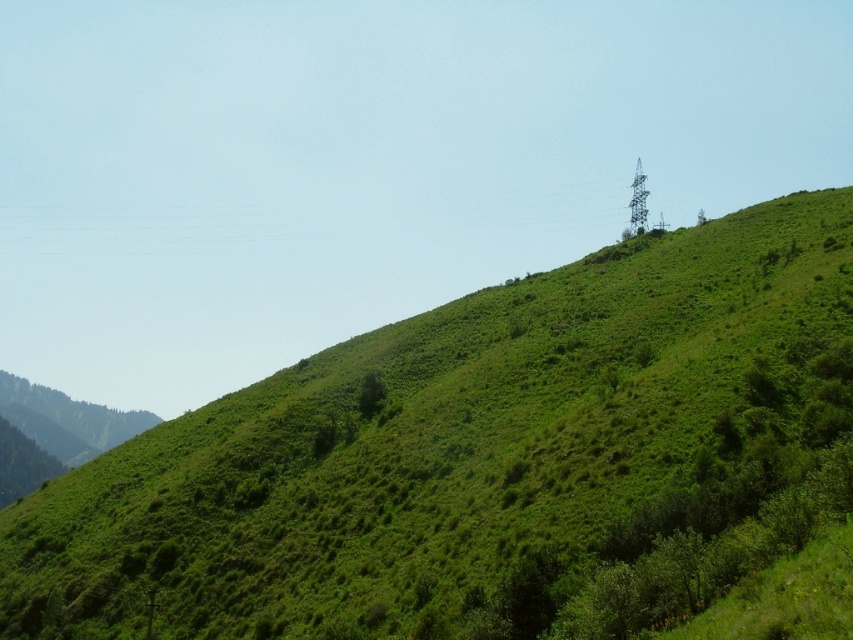
Question: Does green leafy tree at lower left have a greater width compared to green leafy tree at center?

Choices:
 (A) yes
 (B) no

Answer: (A)

Question: Considering the real-world distances, which object is farthest from the green grassy hill at upper center?

Choices:
 (A) green leafy tree at lower left
 (B) green leafy tree at center

Answer: (A)

Question: Can you confirm if green grassy hill at upper center is wider than green leafy tree at center?

Choices:
 (A) no
 (B) yes

Answer: (B)

Question: Does green leafy tree at lower left come behind green leafy tree at center?

Choices:
 (A) no
 (B) yes

Answer: (B)

Question: Considering the real-world distances, which object is farthest from the green leafy tree at center?

Choices:
 (A) green grassy hill at upper center
 (B) green leafy tree at lower left

Answer: (B)

Question: Which of these objects is positioned closest to the green leafy tree at center?

Choices:
 (A) green grassy hill at upper center
 (B) green leafy tree at lower left

Answer: (A)